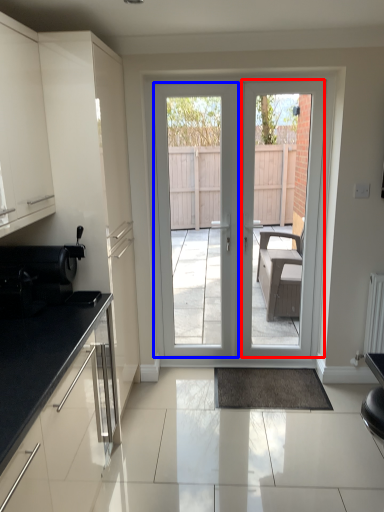
Question: Which object is further to the camera taking this photo, screen door (highlighted by a red box) or screen door (highlighted by a blue box)?

Choices:
 (A) screen door
 (B) screen door

Answer: (B)